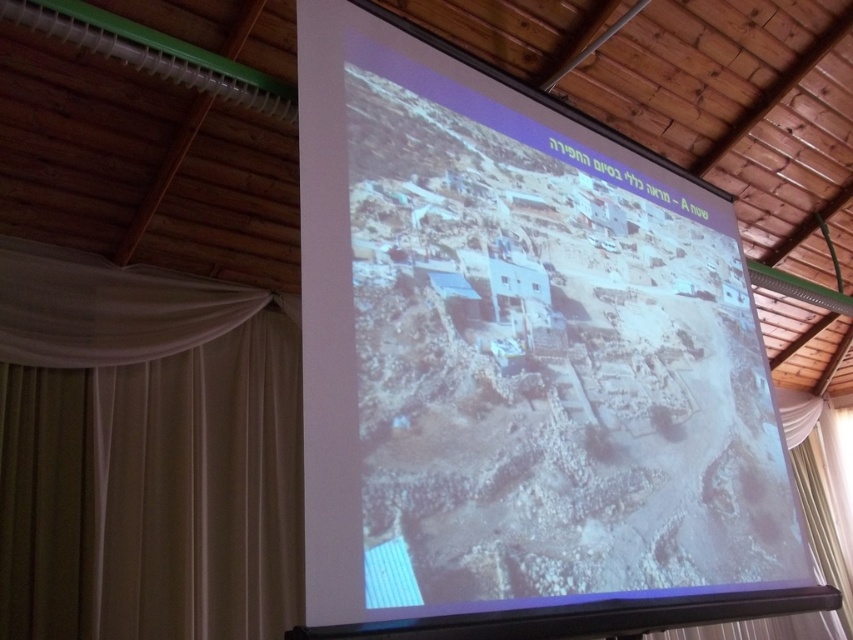
Question: Which of the following is the closest to the observer?

Choices:
 (A) white sheer curtain at lower right
 (B) beige fabric curtain at left
 (C) gray stone wall at center

Answer: (C)

Question: Is gray stone wall at center bigger than white sheer curtain at lower right?

Choices:
 (A) no
 (B) yes

Answer: (B)

Question: Is beige fabric curtain at left smaller than white sheer curtain at lower right?

Choices:
 (A) yes
 (B) no

Answer: (A)

Question: Does beige fabric curtain at left lie behind white sheer curtain at lower right?

Choices:
 (A) yes
 (B) no

Answer: (B)

Question: Among these points, which one is farthest from the camera?

Choices:
 (A) (814, 484)
 (B) (264, 586)
 (C) (616, 513)

Answer: (A)

Question: Among these points, which one is nearest to the camera?

Choices:
 (A) (582, 140)
 (B) (784, 388)
 (C) (192, 426)

Answer: (A)